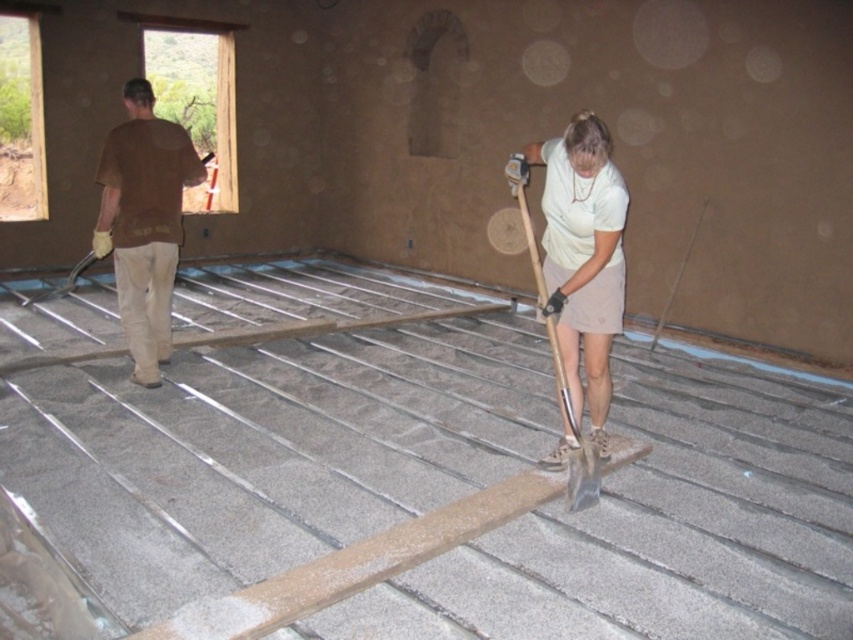
Question: In this image, where is brown cotton shirt at left located relative to metallic silver shovel at center?

Choices:
 (A) below
 (B) above

Answer: (B)

Question: Among these points, which one is farthest from the camera?

Choices:
 (A) (154, 346)
 (B) (596, 502)

Answer: (A)

Question: Is brown cotton shirt at left wider than metallic silver shovel at center?

Choices:
 (A) no
 (B) yes

Answer: (B)

Question: Is brown cotton shirt at left to the right of metallic silver shovel at center from the viewer's perspective?

Choices:
 (A) no
 (B) yes

Answer: (A)